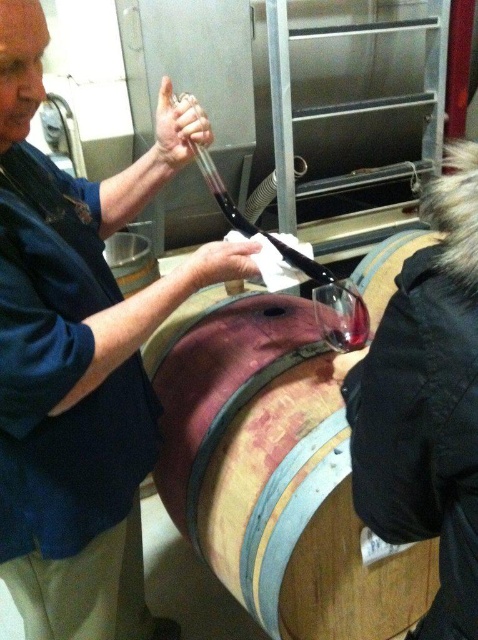
You are a visitor at the winery and want to take a photo of both the matte black wine barrel at center and the wooden barrel at center. Which one should you focus on first to ensure it is in sharp focus?

The matte black wine barrel at center is closer to the viewer than the wooden barrel at center. Therefore, you should focus on the matte black wine barrel at center first to ensure it is in sharp focus.

You are a wine taster standing in front of the matte black wine barrel at center and the transparent glass at center. Which object is nearer to you?

The matte black wine barrel at center is closer to the viewer than the transparent glass at center.

You are a wine taster standing at the point labeled as point [79,360]. You need to locate the matte black wine barrel at center. Is the barrel directly in front of you?

Yes, the point [79,360] indicates that the matte black wine barrel at center is directly in front of you.